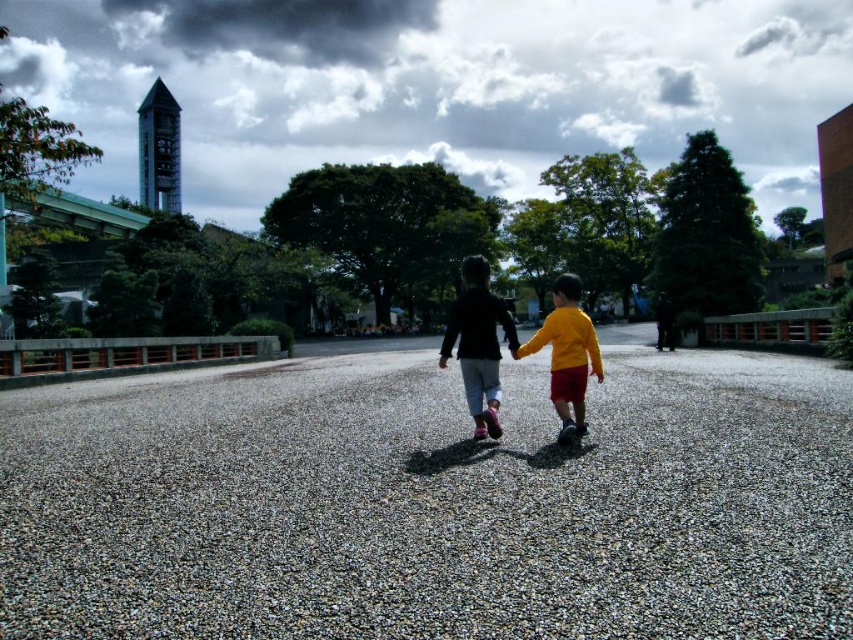
Question: Is gray gravel at center smaller than matte black jacket at center?

Choices:
 (A) no
 (B) yes

Answer: (B)

Question: Is matte black pants at center positioned before yellow matte shirt at center?

Choices:
 (A) yes
 (B) no

Answer: (B)

Question: Which of the following is the closest to the observer?

Choices:
 (A) (677, 461)
 (B) (468, 378)
 (C) (490, 419)

Answer: (A)

Question: Which of the following is the closest to the observer?

Choices:
 (A) (601, 364)
 (B) (660, 548)
 (C) (485, 394)

Answer: (B)

Question: Among these points, which one is nearest to the camera?

Choices:
 (A) (334, 428)
 (B) (585, 369)
 (C) (492, 432)
 (D) (502, 314)

Answer: (C)

Question: Can you confirm if gray gravel at center is positioned to the right of yellow matte shirt at center?

Choices:
 (A) no
 (B) yes

Answer: (A)